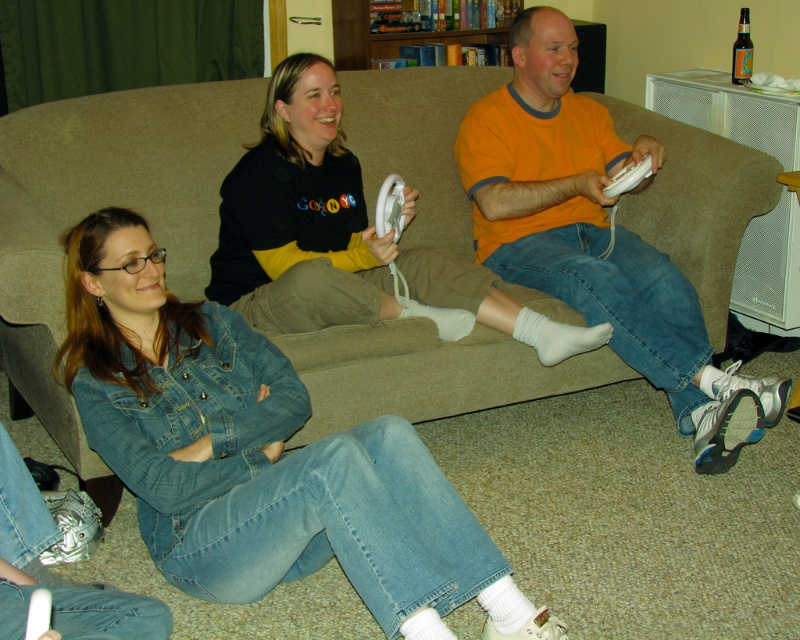
Question: Does beige fabric couch at center have a lesser width compared to orange cotton shirt at center?

Choices:
 (A) no
 (B) yes

Answer: (B)

Question: Which point is farther to the camera?

Choices:
 (A) denim jacket at lower left
 (B) beige fabric couch at center

Answer: (B)

Question: Which point is farther to the camera?

Choices:
 (A) beige fabric couch at center
 (B) white plastic remote at center

Answer: (B)

Question: Is black matte sweatshirt at upper center closer to the viewer compared to white plastic remote at center?

Choices:
 (A) no
 (B) yes

Answer: (B)

Question: Which point is closer to the camera?

Choices:
 (A) (724, 145)
 (B) (230, 588)
 (C) (504, 118)

Answer: (B)

Question: Observing the image, what is the correct spatial positioning of denim jacket at lower left in reference to orange cotton shirt at center?

Choices:
 (A) below
 (B) above

Answer: (A)